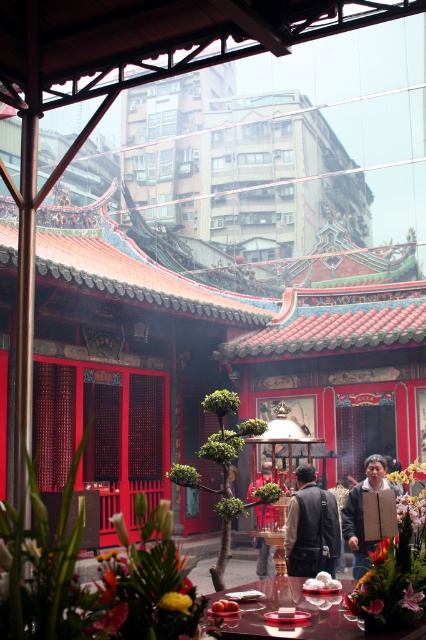
You are a visitor in the temple courtyard and want to place a small offering between the dark gray vest at center and the pink silky flower at center. What is the minimum distance you need to walk to place the offering exactly halfway between them?

The dark gray vest at center and pink silky flower at center are 29.60 feet apart from each other. To place the offering exactly halfway between them, you need to walk 14.80 feet from either object.

You are a visitor in the temple courtyard and notice both the brown fuzzy jacket at center and the smooth orange fruit at center. Which object is closer to you?

The brown fuzzy jacket at center is closer to you because the smooth orange fruit at center is behind it.

You are a visitor in the temple courtyard and notice two items at the center of the scene. Which one is bigger between the brown fuzzy jacket at center and the smooth orange fruit at center?

The brown fuzzy jacket at center is larger in size compared to the smooth orange fruit at center.